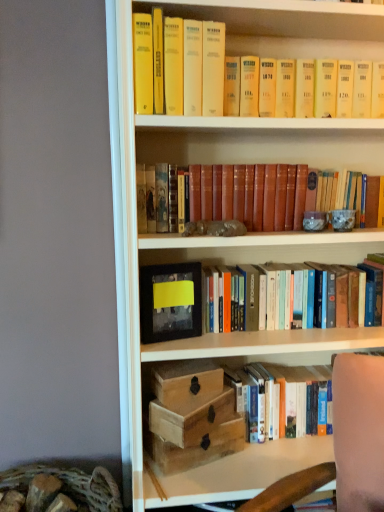
Question: Can you see hardcover book at lower right, positioned as the 1th book in bottom-to-top order, touching wooden box at center?

Choices:
 (A) yes
 (B) no

Answer: (B)

Question: From the image's perspective, is hardcover book at lower right, positioned as the 1th book in bottom-to-top order, below wooden box at center?

Choices:
 (A) no
 (B) yes

Answer: (B)

Question: Is hardcover book at lower right, the third book viewed from the top, positioned far away from wooden box at center?

Choices:
 (A) no
 (B) yes

Answer: (A)

Question: From a real-world perspective, is hardcover book at lower right, positioned as the 1th book in bottom-to-top order, under wooden box at center?

Choices:
 (A) yes
 (B) no

Answer: (A)

Question: Does hardcover book at lower right, positioned as the 1th book in bottom-to-top order, have a smaller size compared to wooden box at center?

Choices:
 (A) yes
 (B) no

Answer: (B)

Question: Looking at the image, does matte black picture frame at center seem bigger or smaller compared to wooden box at lower center, the 1th box positioned from the top?

Choices:
 (A) big
 (B) small

Answer: (B)

Question: Visually, is matte black picture frame at center positioned to the left or to the right of wooden box at lower center, the 1th box positioned from the top?

Choices:
 (A) left
 (B) right

Answer: (A)

Question: Considering the positions of matte black picture frame at center and wooden box at lower center, the 1th box positioned from the top, in the image, is matte black picture frame at center wider or thinner than wooden box at lower center, the 1th box positioned from the top,?

Choices:
 (A) wide
 (B) thin

Answer: (B)

Question: Choose the correct answer: Is matte black picture frame at center inside wooden box at lower center, the 1th box positioned from the top, or outside it?

Choices:
 (A) outside
 (B) inside

Answer: (A)

Question: In terms of size, does leather-bound book at center, acting as the 1th book starting from the top, appear bigger or smaller than matte black picture frame at center?

Choices:
 (A) small
 (B) big

Answer: (B)

Question: From a real-world perspective, is leather-bound book at center, arranged as the 3th book when ordered from the bottom, positioned above or below matte black picture frame at center?

Choices:
 (A) below
 (B) above

Answer: (B)

Question: Is point [281, 178] closer or farther from the camera than point [155, 293]?

Choices:
 (A) farther
 (B) closer

Answer: (A)

Question: In terms of width, does leather-bound book at center, acting as the 1th book starting from the top, look wider or thinner when compared to matte black picture frame at center?

Choices:
 (A) thin
 (B) wide

Answer: (B)

Question: In terms of height, does matte black picture frame at center look taller or shorter compared to hardcover book at lower right, the third book viewed from the top?

Choices:
 (A) tall
 (B) short

Answer: (A)

Question: From the image's perspective, relative to hardcover book at lower right, the third book viewed from the top, is matte black picture frame at center above or below?

Choices:
 (A) below
 (B) above

Answer: (B)